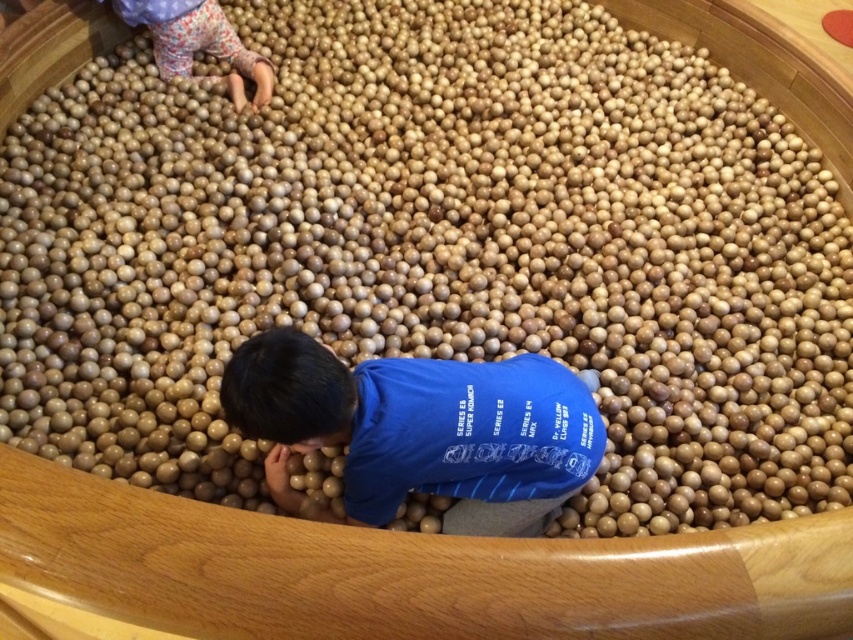
Question: Does blue matte shirt at center come behind floral fabric pants at upper left?

Choices:
 (A) no
 (B) yes

Answer: (A)

Question: Can you confirm if blue matte shirt at center is smaller than floral fabric pants at upper left?

Choices:
 (A) no
 (B) yes

Answer: (A)

Question: Which of the following is the closest to the observer?

Choices:
 (A) (369, 449)
 (B) (173, 22)

Answer: (A)

Question: Observing the image, what is the correct spatial positioning of blue matte shirt at center in reference to floral fabric pants at upper left?

Choices:
 (A) left
 (B) right

Answer: (B)